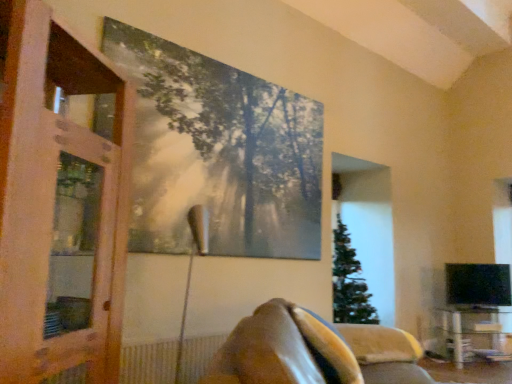
Question: From a real-world perspective, is metallic silver tree at upper center on wooden screen door at left?

Choices:
 (A) yes
 (B) no

Answer: (A)

Question: Does metallic silver tree at upper center lie behind wooden screen door at left?

Choices:
 (A) yes
 (B) no

Answer: (A)

Question: Does metallic silver tree at upper center have a smaller size compared to wooden screen door at left?

Choices:
 (A) no
 (B) yes

Answer: (B)

Question: Can you confirm if metallic silver tree at upper center is wider than wooden screen door at left?

Choices:
 (A) no
 (B) yes

Answer: (A)

Question: Is metallic silver tree at upper center taller than wooden screen door at left?

Choices:
 (A) no
 (B) yes

Answer: (A)

Question: From a real-world perspective, is metallic silver tree at upper center positioned under wooden screen door at left based on gravity?

Choices:
 (A) no
 (B) yes

Answer: (A)

Question: Is brown leather couch at lower center shorter than metallic silver tree at upper center?

Choices:
 (A) yes
 (B) no

Answer: (A)

Question: From a real-world perspective, is brown leather couch at lower center physically above metallic silver tree at upper center?

Choices:
 (A) no
 (B) yes

Answer: (A)

Question: Does brown leather couch at lower center have a larger size compared to metallic silver tree at upper center?

Choices:
 (A) no
 (B) yes

Answer: (B)

Question: Does brown leather couch at lower center touch metallic silver tree at upper center?

Choices:
 (A) no
 (B) yes

Answer: (A)

Question: Does brown leather couch at lower center appear on the left side of metallic silver tree at upper center?

Choices:
 (A) no
 (B) yes

Answer: (A)

Question: Is brown leather couch at lower center further to the viewer compared to metallic silver tree at upper center?

Choices:
 (A) yes
 (B) no

Answer: (B)

Question: Is velvety brown pillow at lower center not near metallic silver tree at upper center?

Choices:
 (A) no
 (B) yes

Answer: (B)